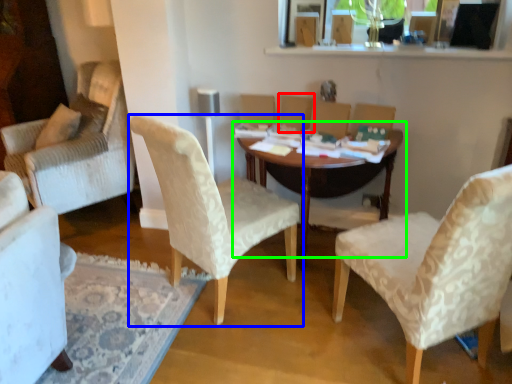
Question: Considering the real-world distances, which object is farthest from armchair (highlighted by a red box)? chair (highlighted by a blue box) or table (highlighted by a green box)?

Choices:
 (A) chair
 (B) table

Answer: (A)